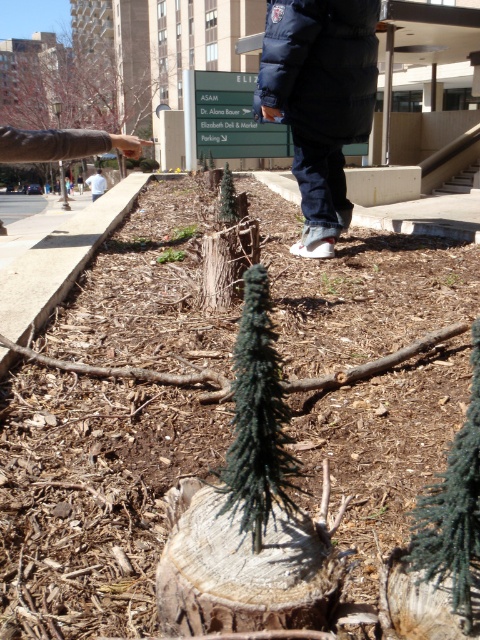
Can you confirm if navy blue puffer jacket at upper center is shorter than white cotton shirt at upper left?

Yes, navy blue puffer jacket at upper center is shorter than white cotton shirt at upper left.

Who is higher up, navy blue puffer jacket at upper center or white cotton shirt at upper left?

white cotton shirt at upper left is above.

Does point (300, 152) lie behind point (94, 180)?

No, (300, 152) is in front of (94, 180).

Where is `navy blue puffer jacket at upper center`? navy blue puffer jacket at upper center is located at coordinates (320, 100).

Is point (20, 99) less distant than point (96, 172)?

No, it is behind (96, 172).

Is point (50, 51) farther from viewer compared to point (92, 177)?

Yes, point (50, 51) is behind point (92, 177).

At what (x,y) coordinates should I click in order to perform the action: click on green artificial tree at upper center. Please return your answer as a coordinate pair (x, y). Looking at the image, I should click on (57, 83).

Locate an element on the screen. The image size is (480, 640). green artificial tree at upper center is located at coordinates (57, 83).

Can you confirm if green matte pine at center is positioned to the left of white cotton shirt at upper left?

In fact, green matte pine at center is to the right of white cotton shirt at upper left.

Is point (231, 384) less distant than point (105, 186)?

That is True.

Identify the location of green matte pine at center. Image resolution: width=480 pixels, height=640 pixels. (257, 419).